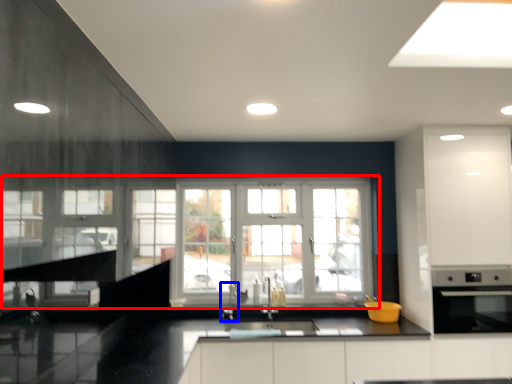
Question: Which object is further to the camera taking this photo, window (highlighted by a red box) or faucet (highlighted by a blue box)?

Choices:
 (A) window
 (B) faucet

Answer: (A)